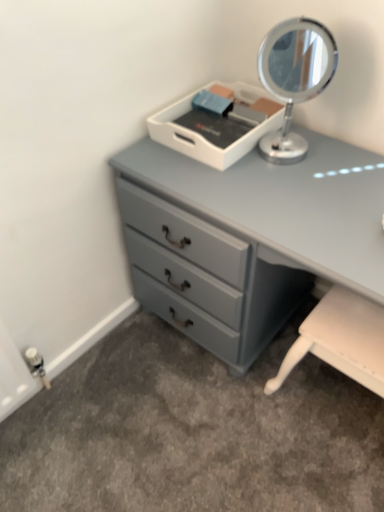
I want to click on free location to the right of silver metallic mirror at upper right, so click(345, 159).